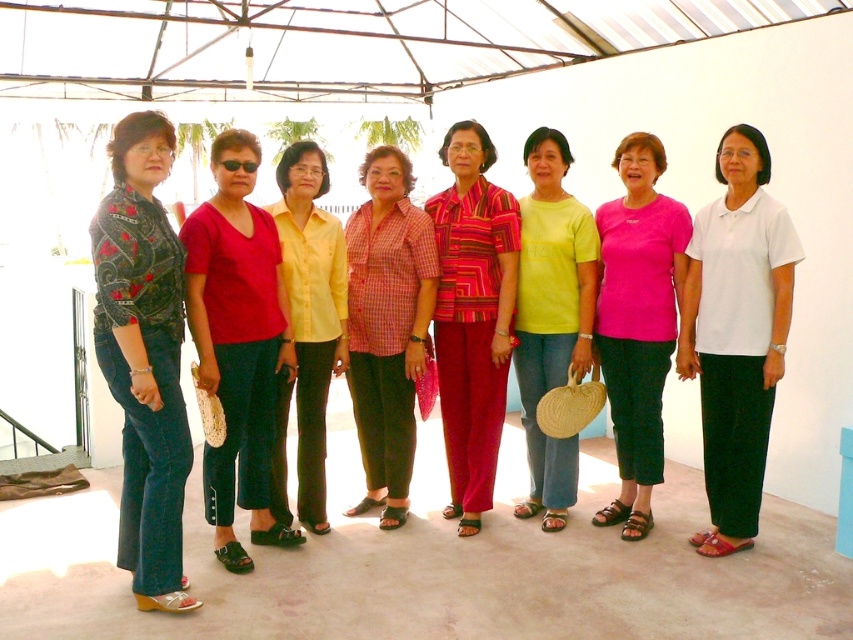
Question: Which of the following is the farthest from the observer?

Choices:
 (A) (653, 141)
 (B) (303, 260)
 (C) (422, 307)
 (D) (271, 428)

Answer: (C)

Question: Is matte red blouse at center positioned at the back of yellow matte shirt at center?

Choices:
 (A) no
 (B) yes

Answer: (A)

Question: Is white cotton blouse at center thinner than yellow matte shirt at center?

Choices:
 (A) yes
 (B) no

Answer: (B)

Question: Does matte red blouse at center have a greater width compared to yellow matte shirt at center?

Choices:
 (A) yes
 (B) no

Answer: (A)

Question: Among these points, which one is farthest from the camera?

Choices:
 (A) (296, 264)
 (B) (177, 476)
 (C) (267, 541)

Answer: (A)

Question: Which is nearer to the patterned fabric blouse at left?

Choices:
 (A) checkered fabric blouse at center
 (B) matte red blouse at center
 (C) white cotton blouse at center

Answer: (B)